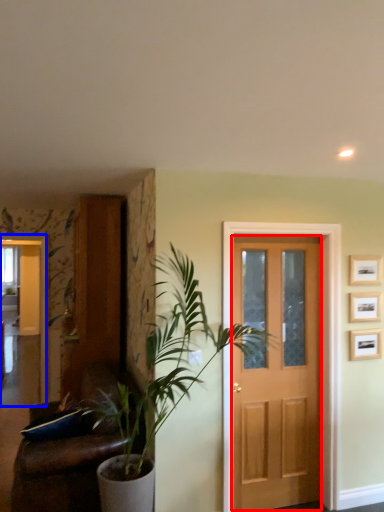
Question: Which of the following is the closest to the observer, screen door (highlighted by a red box) or elevator (highlighted by a blue box)?

Choices:
 (A) screen door
 (B) elevator

Answer: (A)